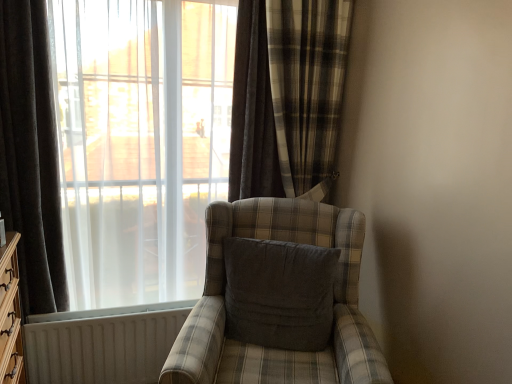
I want to click on plaid fabric curtain at center, the second curtain from the left, so click(287, 97).

Measure the distance between point (17, 64) and camera.

The distance of point (17, 64) from camera is 5.76 feet.

What do you see at coordinates (31, 155) in the screenshot? I see `dark grey velvet curtain at left, placed as the second curtain when sorted from right to left` at bounding box center [31, 155].

At what (x,y) coordinates should I click in order to perform the action: click on plaid fabric chair at center. Please return your answer as a coordinate pair (x, y). The height and width of the screenshot is (384, 512). Looking at the image, I should click on (273, 349).

Is transparent fabric at left far away from plaid fabric chair at center?

They are positioned close to each other.

Does transparent fabric at left appear on the right side of plaid fabric chair at center?

No, transparent fabric at left is not to the right of plaid fabric chair at center.

Based on the photo, is transparent fabric at left bigger than plaid fabric chair at center?

Incorrect, transparent fabric at left is not larger than plaid fabric chair at center.

From a real-world perspective, is transparent fabric at left above or below plaid fabric chair at center?

transparent fabric at left is above plaid fabric chair at center.

From the image's perspective, which is above, dark gray fabric pillow at center or dark grey velvet curtain at left, placed as the second curtain when sorted from right to left?

Answer: dark grey velvet curtain at left, placed as the second curtain when sorted from right to left, from the image's perspective.

Is dark gray fabric pillow at center further to camera compared to dark grey velvet curtain at left, the first curtain viewed from the left?

Yes.

Locate an element on the screen. pillow that is below the dark grey velvet curtain at left, the first curtain viewed from the left (from the image's perspective) is located at coordinates (279, 293).

From a real-world perspective, is dark gray fabric pillow at center above or below white textured radiator at lower left?

Clearly, from a real-world perspective, dark gray fabric pillow at center is above white textured radiator at lower left.

Measure the distance from dark gray fabric pillow at center to white textured radiator at lower left.

dark gray fabric pillow at center is 26.00 inches from white textured radiator at lower left.

Between dark gray fabric pillow at center and white textured radiator at lower left, which one has smaller size?

With smaller size is white textured radiator at lower left.

Is transparent fabric at left facing away from dark grey velvet curtain at left, the first curtain viewed from the left?

transparent fabric at left does not have its back to dark grey velvet curtain at left, the first curtain viewed from the left.

Does point (332, 152) come behind point (7, 57)?

Yes, point (332, 152) is behind point (7, 57).

Can you confirm if transparent fabric at left is wider than dark grey velvet curtain at left, placed as the second curtain when sorted from right to left?

In fact, transparent fabric at left might be narrower than dark grey velvet curtain at left, placed as the second curtain when sorted from right to left.

Considering the relative positions of transparent fabric at left and dark grey velvet curtain at left, the first curtain viewed from the left, in the image provided, is transparent fabric at left to the left or to the right of dark grey velvet curtain at left, the first curtain viewed from the left,?

transparent fabric at left is to the right of dark grey velvet curtain at left, the first curtain viewed from the left.

From the image's perspective, is dark gray fabric pillow at center located above or below transparent fabric at left?

dark gray fabric pillow at center is situated lower than transparent fabric at left in the image.

Is there a large distance between dark gray fabric pillow at center and transparent fabric at left?

No.

What's the angular difference between dark gray fabric pillow at center and transparent fabric at left's facing directions?

26.7 degrees.

Measure the distance between dark gray fabric pillow at center and transparent fabric at left.

dark gray fabric pillow at center is 27.78 inches from transparent fabric at left.

Which object is positioned more to the left, plaid fabric curtain at center, marked as the 1th curtain in a right-to-left arrangement, or white textured radiator at lower left?

white textured radiator at lower left is more to the left.

Is plaid fabric curtain at center, marked as the 1th curtain in a right-to-left arrangement, surrounding white textured radiator at lower left?

No, white textured radiator at lower left is not surrounded by plaid fabric curtain at center, marked as the 1th curtain in a right-to-left arrangement.

Based on the photo, considering the sizes of objects plaid fabric curtain at center, marked as the 1th curtain in a right-to-left arrangement, and white textured radiator at lower left in the image provided, who is bigger, plaid fabric curtain at center, marked as the 1th curtain in a right-to-left arrangement, or white textured radiator at lower left?

With larger size is plaid fabric curtain at center, marked as the 1th curtain in a right-to-left arrangement.

Which of these two, plaid fabric curtain at center, the second curtain from the left, or white textured radiator at lower left, is wider?

With larger width is plaid fabric curtain at center, the second curtain from the left.

Is plaid fabric chair at center not near white textured radiator at lower left?

No.

Which of these two, plaid fabric chair at center or white textured radiator at lower left, stands shorter?

white textured radiator at lower left is shorter.

Does plaid fabric chair at center have a smaller size compared to white textured radiator at lower left?

Actually, plaid fabric chair at center might be larger than white textured radiator at lower left.

At what (x,y) coordinates should I click in order to perform the action: click on radiator located below the plaid fabric chair at center (from the image's perspective). Please return your answer as a coordinate pair (x, y). This screenshot has height=384, width=512. Looking at the image, I should click on (102, 344).

What are the coordinates of `chair located below the transparent fabric at left (from the image's perspective)` in the screenshot? It's located at (273, 349).

The width and height of the screenshot is (512, 384). In order to click on curtain on the left of dark gray fabric pillow at center in this screenshot , I will do `click(31, 155)`.

Estimate the real-world distances between objects in this image. Which object is closer to plaid fabric curtain at center, marked as the 1th curtain in a right-to-left arrangement, dark grey velvet curtain at left, placed as the second curtain when sorted from right to left, or transparent fabric at left?

transparent fabric at left lies closer to plaid fabric curtain at center, marked as the 1th curtain in a right-to-left arrangement, than the other object.

Estimate the real-world distances between objects in this image. Which object is closer to white textured radiator at lower left, dark grey velvet curtain at left, the first curtain viewed from the left, or plaid fabric curtain at center, marked as the 1th curtain in a right-to-left arrangement?

Among the two, dark grey velvet curtain at left, the first curtain viewed from the left, is located nearer to white textured radiator at lower left.

Based on their spatial positions, is plaid fabric curtain at center, marked as the 1th curtain in a right-to-left arrangement, or white textured radiator at lower left closer to dark grey velvet curtain at left, placed as the second curtain when sorted from right to left?

white textured radiator at lower left lies closer to dark grey velvet curtain at left, placed as the second curtain when sorted from right to left, than the other object.

Based on their spatial positions, is plaid fabric curtain at center, marked as the 1th curtain in a right-to-left arrangement, or plaid fabric chair at center closer to white textured radiator at lower left?

plaid fabric chair at center lies closer to white textured radiator at lower left than the other object.

Considering their positions, is dark grey velvet curtain at left, the first curtain viewed from the left, positioned closer to transparent fabric at left than white textured radiator at lower left?

The object closer to transparent fabric at left is dark grey velvet curtain at left, the first curtain viewed from the left.

Which object lies nearer to the anchor point plaid fabric curtain at center, the second curtain from the left, white textured radiator at lower left or dark gray fabric pillow at center?

dark gray fabric pillow at center.

When comparing their distances from plaid fabric curtain at center, marked as the 1th curtain in a right-to-left arrangement, does dark gray fabric pillow at center or dark grey velvet curtain at left, placed as the second curtain when sorted from right to left, seem further?

The object further to plaid fabric curtain at center, marked as the 1th curtain in a right-to-left arrangement, is dark grey velvet curtain at left, placed as the second curtain when sorted from right to left.

Considering their positions, is plaid fabric curtain at center, marked as the 1th curtain in a right-to-left arrangement, positioned closer to dark gray fabric pillow at center than transparent fabric at left?

Based on the image, transparent fabric at left appears to be nearer to dark gray fabric pillow at center.

The width and height of the screenshot is (512, 384). Identify the location of window between dark grey velvet curtain at left, the first curtain viewed from the left, and dark gray fabric pillow at center from left to right. (286, 97).

Image resolution: width=512 pixels, height=384 pixels. Find the location of `window between plaid fabric curtain at center, marked as the 1th curtain in a right-to-left arrangement, and white textured radiator at lower left, in the vertical direction`. window between plaid fabric curtain at center, marked as the 1th curtain in a right-to-left arrangement, and white textured radiator at lower left, in the vertical direction is located at coordinates (286, 97).

Locate an element on the screen. The height and width of the screenshot is (384, 512). chair between transparent fabric at left and white textured radiator at lower left vertically is located at coordinates [273, 349].

This screenshot has width=512, height=384. Identify the location of pillow between plaid fabric curtain at center, marked as the 1th curtain in a right-to-left arrangement, and white textured radiator at lower left, in the vertical direction. (279, 293).